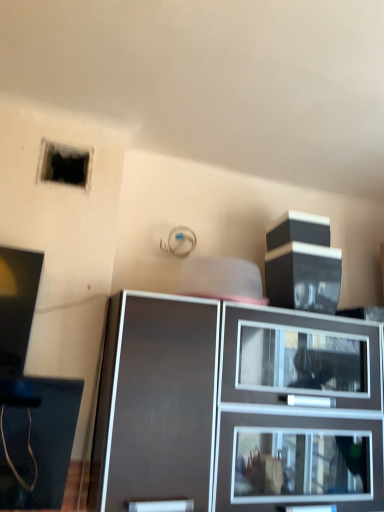
Question: From a real-world perspective, relative to black matte hole at upper left, is matte black cabinet at center vertically above or below?

Choices:
 (A) below
 (B) above

Answer: (A)

Question: Is point (274, 439) closer or farther from the camera than point (86, 159)?

Choices:
 (A) closer
 (B) farther

Answer: (A)

Question: Is matte black cabinet at center in front of or behind black matte hole at upper left in the image?

Choices:
 (A) front
 (B) behind

Answer: (A)

Question: Considering the positions of point (87, 182) and point (251, 367), is point (87, 182) closer or farther from the camera than point (251, 367)?

Choices:
 (A) farther
 (B) closer

Answer: (B)

Question: Is black matte hole at upper left inside or outside of matte black cabinet at center?

Choices:
 (A) inside
 (B) outside

Answer: (B)

Question: Considering their positions, is black matte hole at upper left located in front of or behind matte black cabinet at center?

Choices:
 (A) behind
 (B) front

Answer: (A)

Question: Is black matte hole at upper left wider or thinner than matte black cabinet at center?

Choices:
 (A) wide
 (B) thin

Answer: (B)